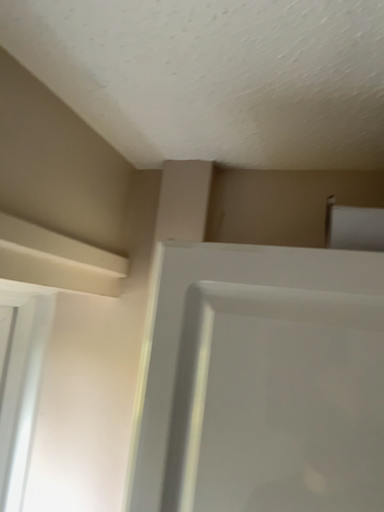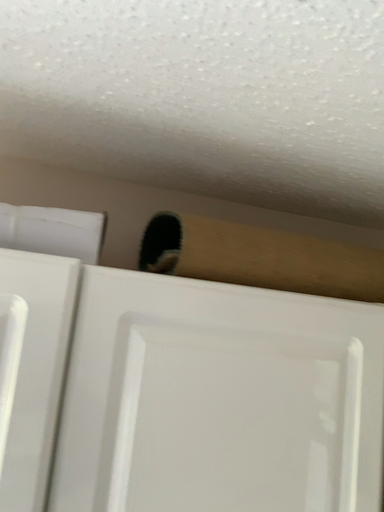
Question: How did the camera likely rotate when shooting the video?

Choices:
 (A) rotated right
 (B) rotated left

Answer: (A)